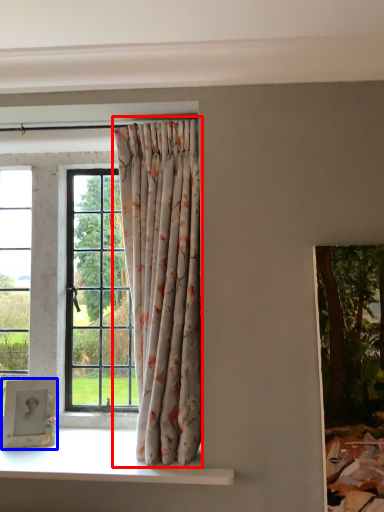
Question: Which object appears closest to the camera in this image, curtain (highlighted by a red box) or picture frame (highlighted by a blue box)?

Choices:
 (A) curtain
 (B) picture frame

Answer: (A)